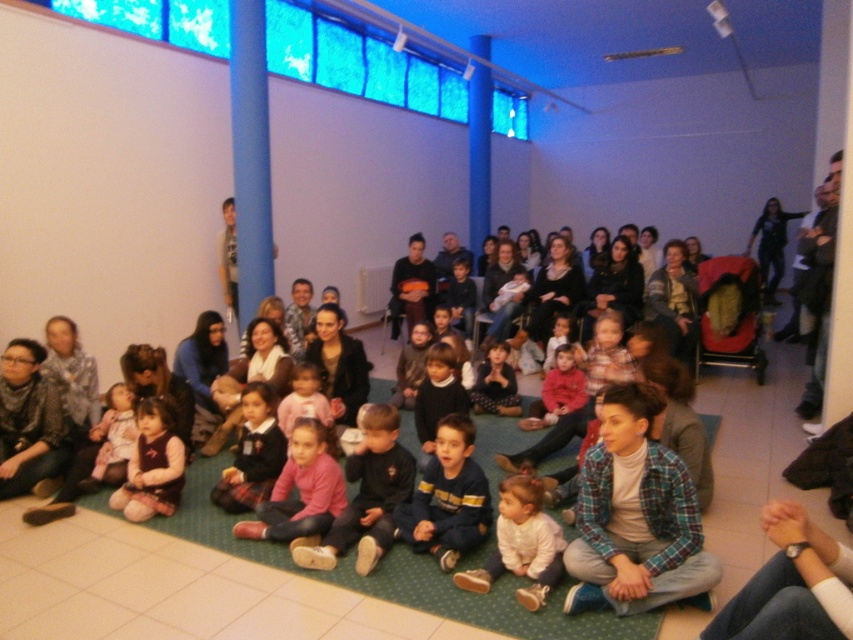
Question: Does white soft fabric at center have a smaller size compared to matte red sweater at center?

Choices:
 (A) yes
 (B) no

Answer: (A)

Question: Which point is farther to the camera?

Choices:
 (A) (573, 406)
 (B) (305, 516)

Answer: (A)

Question: Observing the image, what is the correct spatial positioning of pink matte shirt at center in reference to matte pink sweater at center?

Choices:
 (A) above
 (B) below

Answer: (B)

Question: Among these points, which one is nearest to the camera?

Choices:
 (A) (315, 477)
 (B) (664, 577)
 (C) (525, 428)

Answer: (B)

Question: Does pink fabric pants at lower center come in front of light pink fabric dress at lower left?

Choices:
 (A) yes
 (B) no

Answer: (A)

Question: Based on their relative distances, which object is nearer to the white soft fabric at center?

Choices:
 (A) pink matte shirt at center
 (B) plaid fabric shirt at center

Answer: (B)